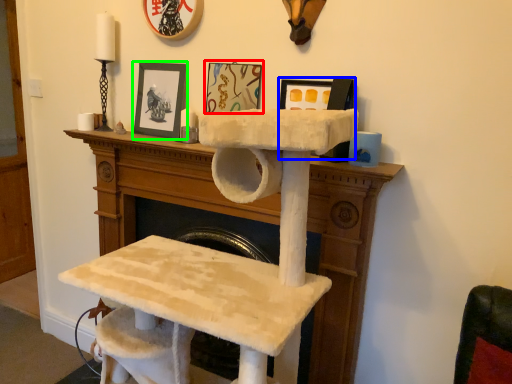
Question: Estimate the real-world distances between objects in this image. Which object is farther from picture frame (highlighted by a red box), picture frame (highlighted by a blue box) or picture frame (highlighted by a green box)?

Choices:
 (A) picture frame
 (B) picture frame

Answer: (A)